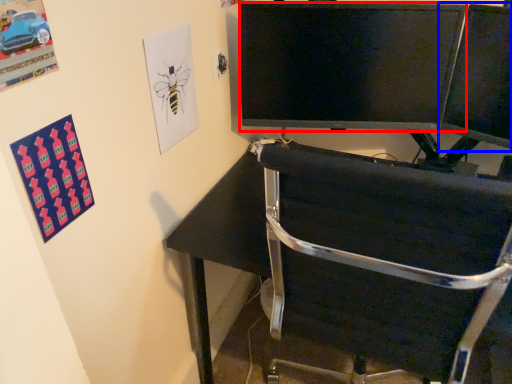
Question: Which point is closer to the camera, television (highlighted by a red box) or computer monitor (highlighted by a blue box)?

Choices:
 (A) television
 (B) computer monitor

Answer: (B)